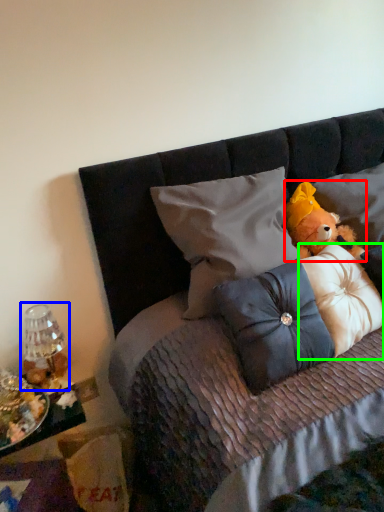
Question: Which object is the closest to the teddy bear (highlighted by a red box)? Choose among these: lamp (highlighted by a blue box) or pillow (highlighted by a green box).

Choices:
 (A) lamp
 (B) pillow

Answer: (B)